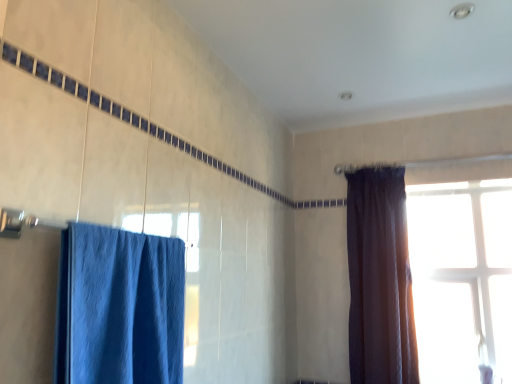
What do you see at coordinates (119, 307) in the screenshot? I see `blue fabric curtain at left, the 1th curtain from the front` at bounding box center [119, 307].

Describe the element at coordinates (380, 279) in the screenshot. I see `dark velvet curtain at right, which ranks as the 1th curtain in back-to-front order` at that location.

Identify the location of blue fabric curtain at left, the 1th curtain from the front. This screenshot has width=512, height=384. (119, 307).

From the picture: Is transparent glass window at upper right completely or partially outside of blue fabric curtain at left, which appears as the second curtain when viewed from the right?

That's correct, transparent glass window at upper right is outside of blue fabric curtain at left, which appears as the second curtain when viewed from the right.

Considering the positions of objects transparent glass window at upper right and blue fabric curtain at left, which appears as the second curtain when viewed from the right, in the image provided, who is more to the left, transparent glass window at upper right or blue fabric curtain at left, which appears as the second curtain when viewed from the right,?

blue fabric curtain at left, which appears as the second curtain when viewed from the right.

Can you tell me how much transparent glass window at upper right and blue fabric curtain at left, the 1th curtain from the front, differ in facing direction?

90.5 degrees separate the facing orientations of transparent glass window at upper right and blue fabric curtain at left, the 1th curtain from the front.

From the picture: From a real-world perspective, which is physically above, transparent glass window at upper right or blue fabric curtain at left, the 1th curtain from the front?

From a 3D spatial view, transparent glass window at upper right is above.

Between dark velvet curtain at right, placed as the 2th curtain when sorted from left to right, and transparent glass window at upper right, which one has less height?

transparent glass window at upper right.

Between dark velvet curtain at right, which ranks as the 1th curtain in back-to-front order, and transparent glass window at upper right, which one appears on the right side from the viewer's perspective?

transparent glass window at upper right is more to the right.

Between point (390, 250) and point (495, 254), which one is positioned behind?

The point (495, 254) is farther from the camera.

Is dark velvet curtain at right, placed as the 2th curtain when sorted from left to right, surrounded by blue fabric curtain at left, which ranks as the 2th curtain in back-to-front order?

No, dark velvet curtain at right, placed as the 2th curtain when sorted from left to right, is not surrounded by blue fabric curtain at left, which ranks as the 2th curtain in back-to-front order.

In the image, is blue fabric curtain at left, the 1th curtain from the front, on the left side or the right side of dark velvet curtain at right, the first curtain when ordered from right to left?

Based on their positions, blue fabric curtain at left, the 1th curtain from the front, is located to the left of dark velvet curtain at right, the first curtain when ordered from right to left.

Is blue fabric curtain at left, the 1th curtain from the front, positioned far away from dark velvet curtain at right, the first curtain when ordered from right to left?

blue fabric curtain at left, the 1th curtain from the front, is far away from dark velvet curtain at right, the first curtain when ordered from right to left.

Who is smaller, blue fabric curtain at left, the 1th curtain from the front, or dark velvet curtain at right, the second curtain in the front-to-back sequence?

blue fabric curtain at left, the 1th curtain from the front, is smaller.

How many degrees apart are the facing directions of dark velvet curtain at right, the first curtain when ordered from right to left, and blue fabric curtain at left, which ranks as the 2th curtain in back-to-front order?

They differ by 91.4 degrees in their facing directions.

Does point (417, 376) come farther from viewer compared to point (176, 292)?

Yes, it is.

Is dark velvet curtain at right, the second curtain in the front-to-back sequence, touching blue fabric curtain at left, the 1th curtain from the front?

No, dark velvet curtain at right, the second curtain in the front-to-back sequence, is not making contact with blue fabric curtain at left, the 1th curtain from the front.

Does dark velvet curtain at right, placed as the 2th curtain when sorted from left to right, have a lesser width compared to blue fabric curtain at left, which appears as the second curtain when viewed from the right?

Correct, the width of dark velvet curtain at right, placed as the 2th curtain when sorted from left to right, is less than that of blue fabric curtain at left, which appears as the second curtain when viewed from the right.

Is transparent glass window at upper right located outside dark velvet curtain at right, the first curtain when ordered from right to left?

Indeed, transparent glass window at upper right is completely outside dark velvet curtain at right, the first curtain when ordered from right to left.

There is a transparent glass window at upper right. Identify the location of curtain above it (from a real-world perspective). (380, 279).

Considering the relative sizes of transparent glass window at upper right and dark velvet curtain at right, the second curtain in the front-to-back sequence, in the image provided, is transparent glass window at upper right thinner than dark velvet curtain at right, the second curtain in the front-to-back sequence,?

Correct, the width of transparent glass window at upper right is less than that of dark velvet curtain at right, the second curtain in the front-to-back sequence.

Between transparent glass window at upper right and dark velvet curtain at right, the first curtain when ordered from right to left, which one appears on the right side from the viewer's perspective?

transparent glass window at upper right is more to the right.

Is transparent glass window at upper right at the back of blue fabric curtain at left, the first curtain viewed from the left?

No, blue fabric curtain at left, the first curtain viewed from the left, is not facing the opposite direction of transparent glass window at upper right.

Which is behind, point (174, 358) or point (494, 286)?

The point (494, 286) is farther.

Can you confirm if blue fabric curtain at left, the 1th curtain from the front, is wider than transparent glass window at upper right?

Correct, the width of blue fabric curtain at left, the 1th curtain from the front, exceeds that of transparent glass window at upper right.

Identify the location of window that is above the blue fabric curtain at left, the 1th curtain from the front (from a real-world perspective). (432, 278).

Starting from the transparent glass window at upper right, which curtain is the 2nd one to the left? Please provide its 2D coordinates.

[(119, 307)]

From the transparent glass window at upper right, count 1st curtains forward and point to it. Please provide its 2D coordinates.

[(380, 279)]

Based on their spatial positions, is dark velvet curtain at right, the second curtain in the front-to-back sequence, or transparent glass window at upper right closer to blue fabric curtain at left, the 1th curtain from the front?

dark velvet curtain at right, the second curtain in the front-to-back sequence.

Considering their positions, is transparent glass window at upper right positioned further to dark velvet curtain at right, the second curtain in the front-to-back sequence, than blue fabric curtain at left, which ranks as the 2th curtain in back-to-front order?

blue fabric curtain at left, which ranks as the 2th curtain in back-to-front order, is positioned further to the anchor dark velvet curtain at right, the second curtain in the front-to-back sequence.

Based on their spatial positions, is blue fabric curtain at left, which ranks as the 2th curtain in back-to-front order, or transparent glass window at upper right closer to dark velvet curtain at right, which ranks as the 1th curtain in back-to-front order?

transparent glass window at upper right lies closer to dark velvet curtain at right, which ranks as the 1th curtain in back-to-front order, than the other object.

Estimate the real-world distances between objects in this image. Which object is further from transparent glass window at upper right, blue fabric curtain at left, the first curtain viewed from the left, or dark velvet curtain at right, placed as the 2th curtain when sorted from left to right?

The object further to transparent glass window at upper right is blue fabric curtain at left, the first curtain viewed from the left.

From the image, which object appears to be farther from transparent glass window at upper right, dark velvet curtain at right, which ranks as the 1th curtain in back-to-front order, or blue fabric curtain at left, the first curtain viewed from the left?

Based on the image, blue fabric curtain at left, the first curtain viewed from the left, appears to be further to transparent glass window at upper right.

From the image, which object appears to be farther from blue fabric curtain at left, the first curtain viewed from the left, transparent glass window at upper right or dark velvet curtain at right, the second curtain in the front-to-back sequence?

Among the two, transparent glass window at upper right is located further to blue fabric curtain at left, the first curtain viewed from the left.

Locate an element on the screen. Image resolution: width=512 pixels, height=384 pixels. curtain between blue fabric curtain at left, which appears as the second curtain when viewed from the right, and transparent glass window at upper right from front to back is located at coordinates (380, 279).